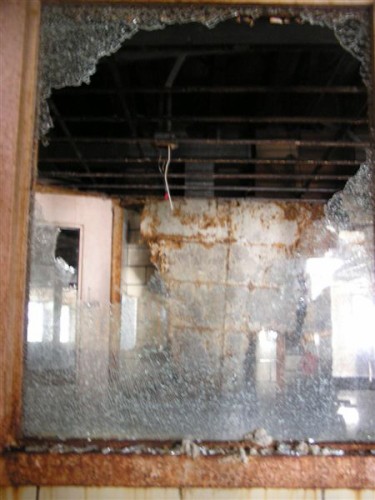
Where is `edge of brown wall`? The height and width of the screenshot is (500, 375). edge of brown wall is located at coordinates (8, 12), (7, 76), (5, 162).